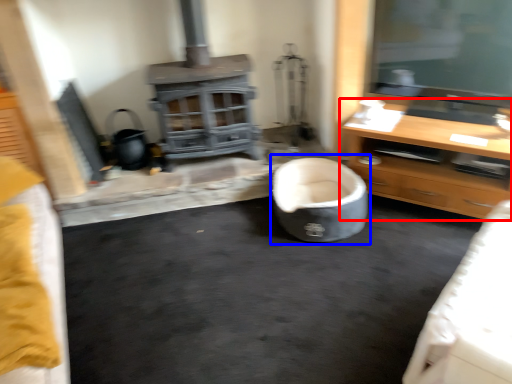
Question: Which object is further to the camera taking this photo, cabinetry (highlighted by a red box) or bean bag chair (highlighted by a blue box)?

Choices:
 (A) cabinetry
 (B) bean bag chair

Answer: (B)